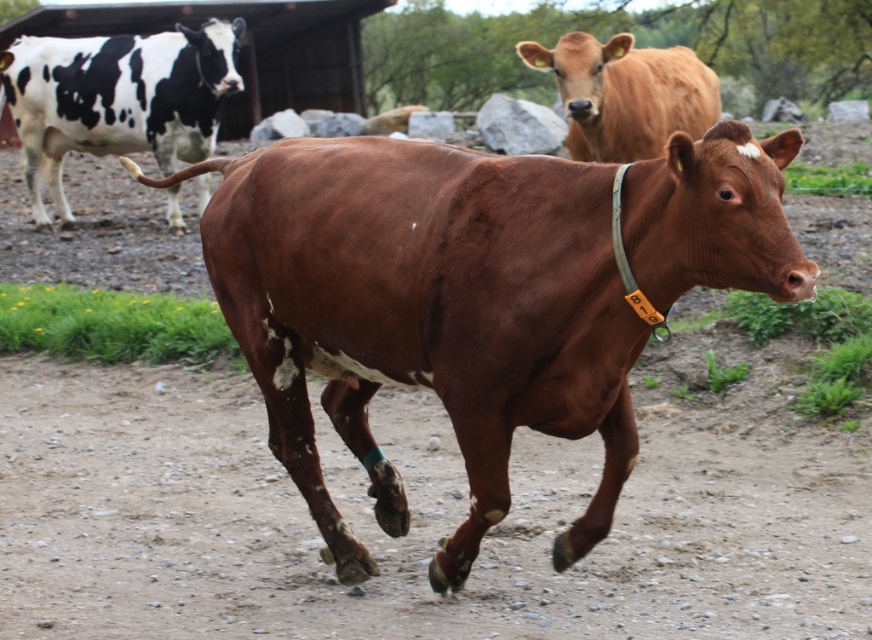
Question: Is brown smooth cow at center smaller than brown smooth cow at upper center?

Choices:
 (A) yes
 (B) no

Answer: (B)

Question: Is black and white spotted cow at upper left further to the viewer compared to brown smooth cow at upper center?

Choices:
 (A) no
 (B) yes

Answer: (B)

Question: Which object is closer to the camera taking this photo?

Choices:
 (A) brown smooth cow at upper center
 (B) black and white spotted cow at upper left
 (C) brown smooth cow at center

Answer: (C)

Question: Which of the following is the farthest from the observer?

Choices:
 (A) brown smooth cow at upper center
 (B) black and white spotted cow at upper left
 (C) brown smooth cow at center

Answer: (B)

Question: Which object is farther from the camera taking this photo?

Choices:
 (A) brown smooth cow at upper center
 (B) black and white spotted cow at upper left
 (C) brown smooth cow at center

Answer: (B)

Question: Considering the relative positions of brown smooth cow at center and brown smooth cow at upper center in the image provided, where is brown smooth cow at center located with respect to brown smooth cow at upper center?

Choices:
 (A) below
 (B) above

Answer: (A)